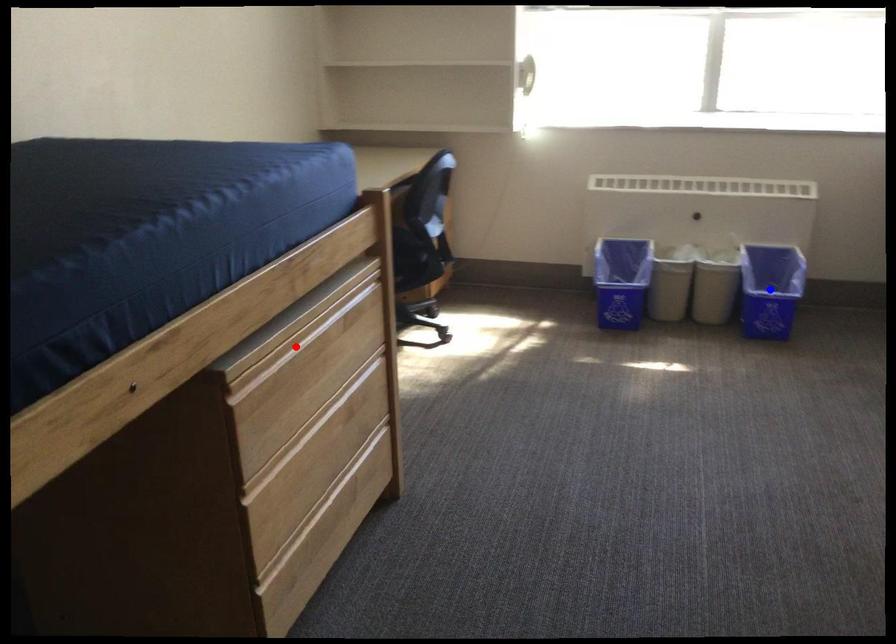
Question: In the image, two points are highlighted. Which point is nearer to the camera? Reply with the corresponding letter.

Choices:
 (A) blue point
 (B) red point

Answer: (B)